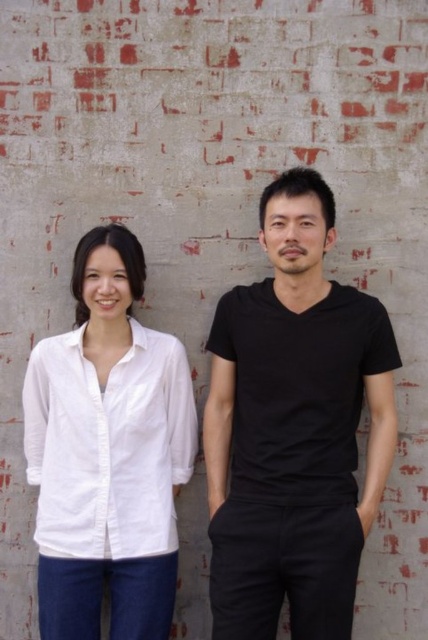
You are standing in front of the brick wall and want to place a small sticker on the wall. You have two points marked on the wall at coordinates point (294, 480) and point (92, 392). Which point is closer to you so you can place the sticker more easily?

Point (294, 480) is closer to the viewer than point (92, 392), so you should place the sticker there for easier access.